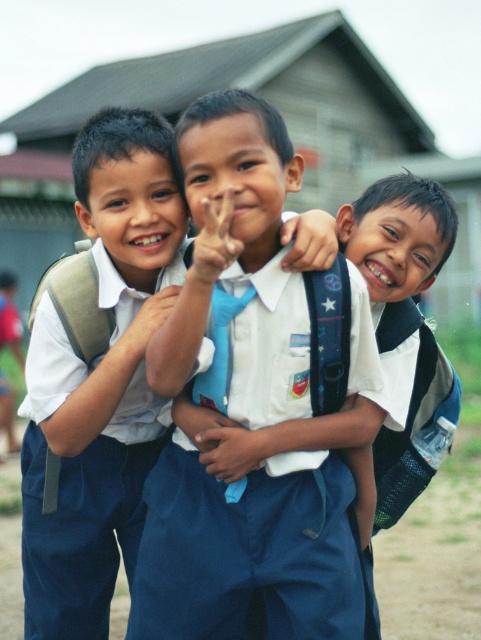
Question: Which of these objects is positioned farthest from the white fabric shirt at center?

Choices:
 (A) white matte uniform at left
 (B) white uniform shirt at center

Answer: (A)

Question: Does white uniform shirt at center come in front of white fabric shirt at center?

Choices:
 (A) no
 (B) yes

Answer: (B)

Question: Is white uniform shirt at center closer to the viewer compared to white matte uniform at left?

Choices:
 (A) no
 (B) yes

Answer: (B)

Question: Which object is farther from the camera taking this photo?

Choices:
 (A) white fabric shirt at center
 (B) white matte uniform at left

Answer: (A)

Question: Can you confirm if white uniform shirt at center is positioned below white matte uniform at left?

Choices:
 (A) no
 (B) yes

Answer: (A)

Question: Which point is farther to the camera?

Choices:
 (A) (117, 115)
 (B) (379, 452)
 (C) (299, 474)

Answer: (B)